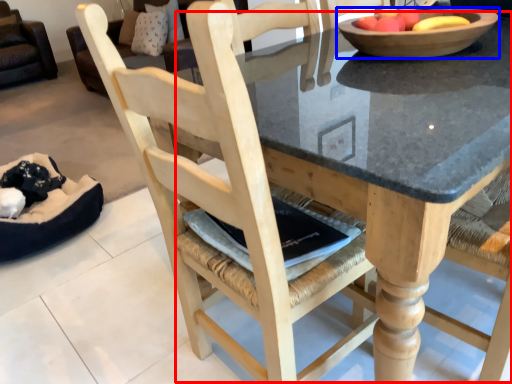
Question: Which object is closer to the camera taking this photo, round table (highlighted by a red box) or bowl (highlighted by a blue box)?

Choices:
 (A) round table
 (B) bowl

Answer: (A)